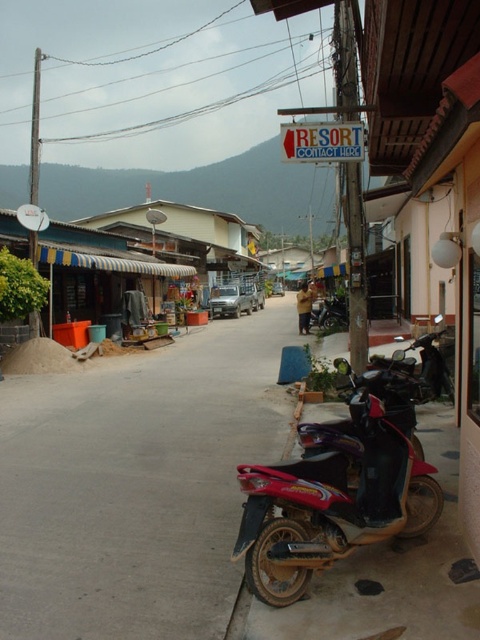
You are standing at the entrance of the street scene and want to find the smooth concrete alley at center. Based on the 2D coordinates provided, in which direction should you walk to locate it?

The smooth concrete alley at center is located at coordinates point (137, 484). Since the coordinate system typically places the origin at the bottom left corner, moving towards the right and slightly upward would lead you to the smooth concrete alley at center.

You are a delivery person trying to navigate through the street scene. You need to pass through the smooth concrete alley at center and avoid the shiny red motorcycle at lower right. Given their heights, which one should you adjust your path for and why?

The smooth concrete alley at center has a lesser height compared to the shiny red motorcycle at lower right. Therefore, you should adjust your path to avoid hitting the shiny red motorcycle at lower right, as it is taller and might obstruct your passage.